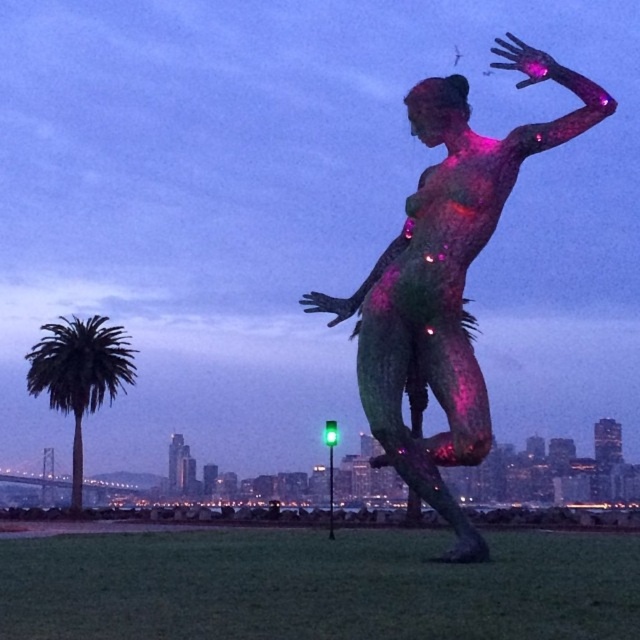
Question: Is translucent pinkish-purple figure at center below green leafy palm tree at left?

Choices:
 (A) no
 (B) yes

Answer: (A)

Question: Which of the following is the closest to the observer?

Choices:
 (A) green leafy palm tree at left
 (B) translucent pinkish-purple figure at center

Answer: (B)

Question: Does translucent pinkish-purple figure at center appear over green leafy palm tree at left?

Choices:
 (A) no
 (B) yes

Answer: (B)

Question: Observing the image, what is the correct spatial positioning of translucent pinkish-purple figure at center in reference to green leafy palm tree at left?

Choices:
 (A) right
 (B) left

Answer: (A)

Question: Which of the following is the closest to the observer?

Choices:
 (A) translucent pinkish-purple figure at center
 (B) green leafy palm tree at left

Answer: (A)